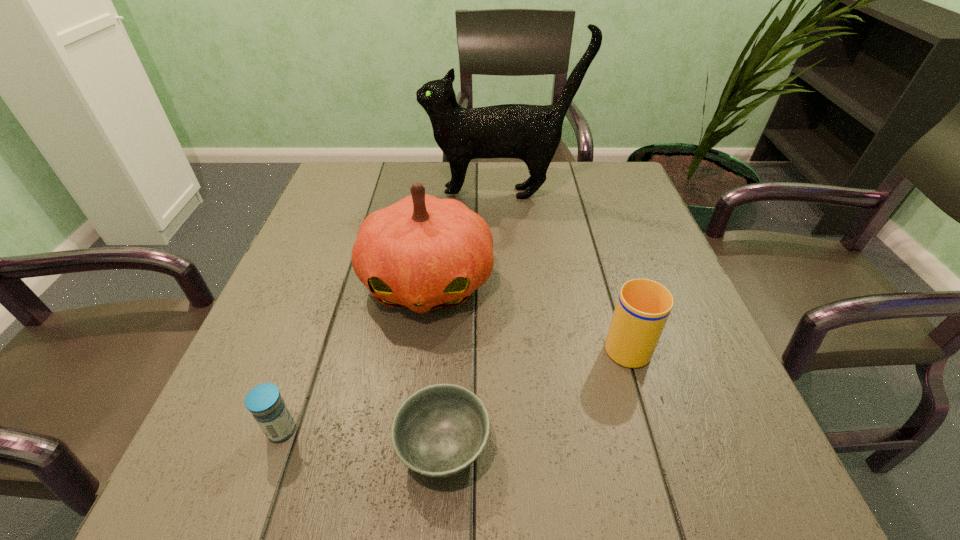
Where is `the farthest object`? the farthest object is located at coordinates (532, 133).

Locate an element on the screen. The image size is (960, 540). the tallest object is located at coordinates (532, 133).

The height and width of the screenshot is (540, 960). Find the location of `pumpkin`. pumpkin is located at coordinates (422, 253).

At what (x,y) coordinates should I click in order to perform the action: click on the third tallest object. Please return your answer as a coordinate pair (x, y). Looking at the image, I should click on (643, 306).

Identify the location of medicine. (264, 401).

The height and width of the screenshot is (540, 960). Identify the location of the leftmost object. (264, 401).

Find the location of a particular element. This screenshot has width=960, height=540. bowl is located at coordinates point(440,430).

Identify the location of free location located on the face of the tallest object. (349, 193).

Locate an element on the screen. free space located on the face of the tallest object is located at coordinates (372, 193).

Locate an element on the screen. free space located 0.200m on the face of the tallest object is located at coordinates [349, 193].